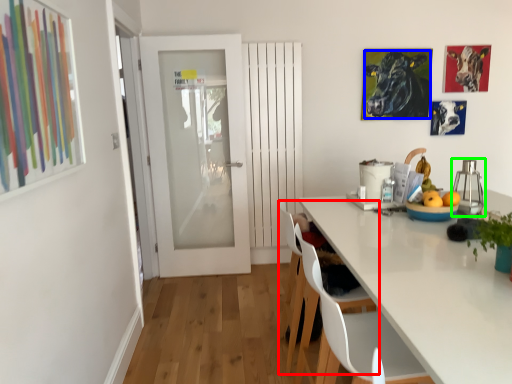
Question: Considering the real-world distances, which object is closest to chair (highlighted by a red box)? cattle (highlighted by a blue box) or appliance (highlighted by a green box).

Choices:
 (A) cattle
 (B) appliance

Answer: (B)